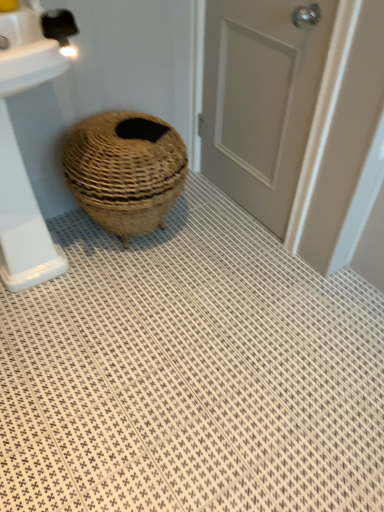
Question: Can you confirm if natural woven basket at center is shorter than matte gray door at center?

Choices:
 (A) yes
 (B) no

Answer: (A)

Question: Is the surface of natural woven basket at center in direct contact with matte gray door at center?

Choices:
 (A) yes
 (B) no

Answer: (B)

Question: Is there a large distance between natural woven basket at center and matte gray door at center?

Choices:
 (A) no
 (B) yes

Answer: (A)

Question: From the image's perspective, is natural woven basket at center beneath matte gray door at center?

Choices:
 (A) yes
 (B) no

Answer: (A)

Question: Is natural woven basket at center oriented towards matte gray door at center?

Choices:
 (A) yes
 (B) no

Answer: (B)

Question: Can you confirm if natural woven basket at center is thinner than matte gray door at center?

Choices:
 (A) no
 (B) yes

Answer: (A)

Question: Is white textured bath mat at center smaller than white glossy sink at left?

Choices:
 (A) no
 (B) yes

Answer: (B)

Question: From a real-world perspective, is white textured bath mat at center on white glossy sink at left?

Choices:
 (A) no
 (B) yes

Answer: (A)

Question: Does white textured bath mat at center have a lesser height compared to white glossy sink at left?

Choices:
 (A) no
 (B) yes

Answer: (B)

Question: From a real-world perspective, does white textured bath mat at center sit lower than white glossy sink at left?

Choices:
 (A) yes
 (B) no

Answer: (A)

Question: Is white textured bath mat at center at the left side of white glossy sink at left?

Choices:
 (A) yes
 (B) no

Answer: (B)

Question: Is white textured bath mat at center oriented away from white glossy sink at left?

Choices:
 (A) yes
 (B) no

Answer: (B)

Question: Can you confirm if white glossy sink at left is wider than natural woven basket at center?

Choices:
 (A) no
 (B) yes

Answer: (B)